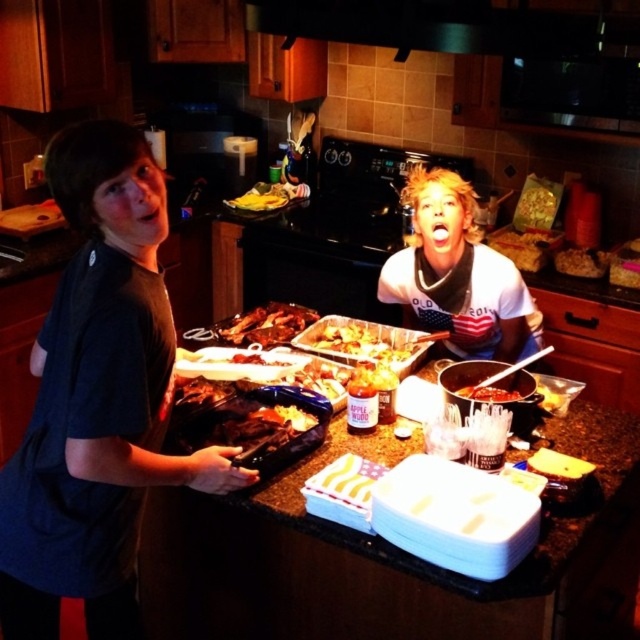
Question: Considering the relative positions of golden brown crispy chicken at center and yellow banana at upper center in the image provided, where is golden brown crispy chicken at center located with respect to yellow banana at upper center?

Choices:
 (A) left
 (B) right

Answer: (B)

Question: Which of the following is the closest to the observer?

Choices:
 (A) black matte exhaust hood at upper center
 (B) golden crispy chicken at center
 (C) yellow banana at upper center
 (D) smooth brown bread at center

Answer: (A)

Question: Considering the relative positions of yellow banana at upper center and saucesmoothbowl at center in the image provided, where is yellow banana at upper center located with respect to saucesmoothbowl at center?

Choices:
 (A) below
 (B) above

Answer: (B)

Question: Which point is farther from the camera taking this photo?

Choices:
 (A) (522, 259)
 (B) (596, 35)
 (C) (227, 326)
 (D) (582, 276)

Answer: (A)

Question: Among these objects, which one is farthest from the camera?

Choices:
 (A) saucesmoothbowl at center
 (B) dark blue shirt at left
 (C) yellow banana at upper center
 (D) brown crumbly cookie at center

Answer: (C)

Question: Is dark blue shirt at left bigger than black matte exhaust hood at upper center?

Choices:
 (A) yes
 (B) no

Answer: (B)